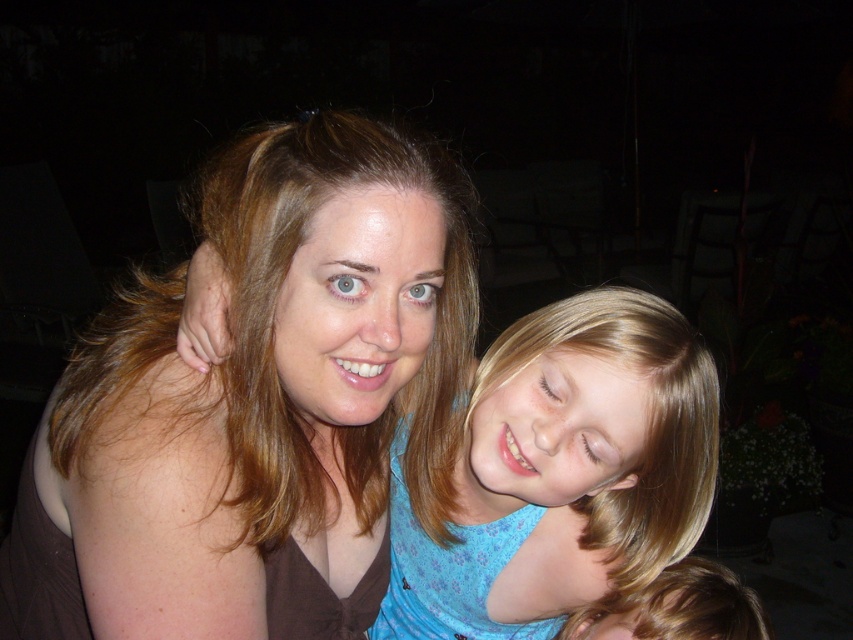
Question: Which of the following is the farthest from the observer?

Choices:
 (A) (514, 538)
 (B) (386, 211)

Answer: (A)

Question: Does matte brown shirt at center lie in front of blue floral shirt at center?

Choices:
 (A) no
 (B) yes

Answer: (B)

Question: Is matte brown shirt at center behind blue floral shirt at center?

Choices:
 (A) no
 (B) yes

Answer: (A)

Question: Does matte brown shirt at center appear on the left side of blue floral shirt at center?

Choices:
 (A) yes
 (B) no

Answer: (A)

Question: Which point appears farthest from the camera in this image?

Choices:
 (A) (178, 272)
 (B) (502, 449)

Answer: (A)